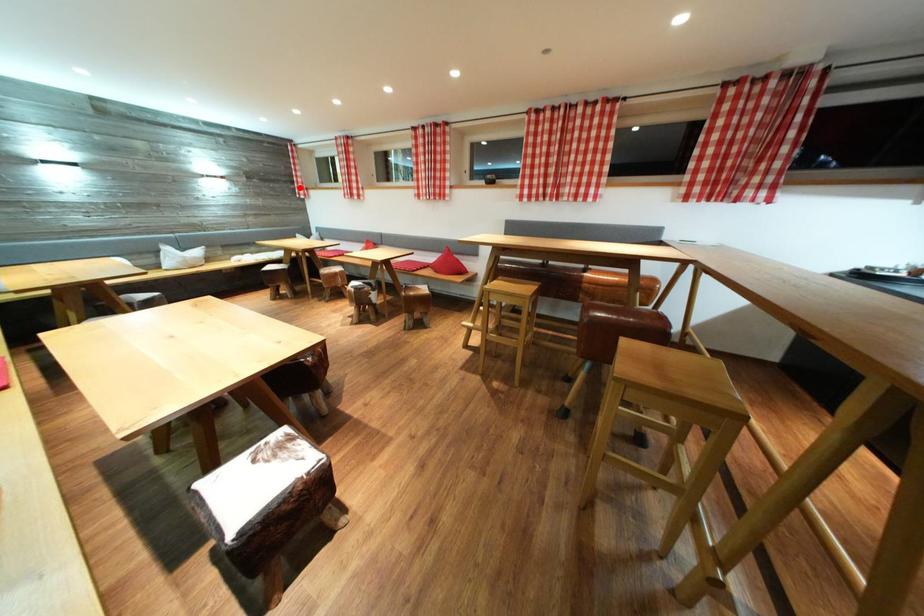
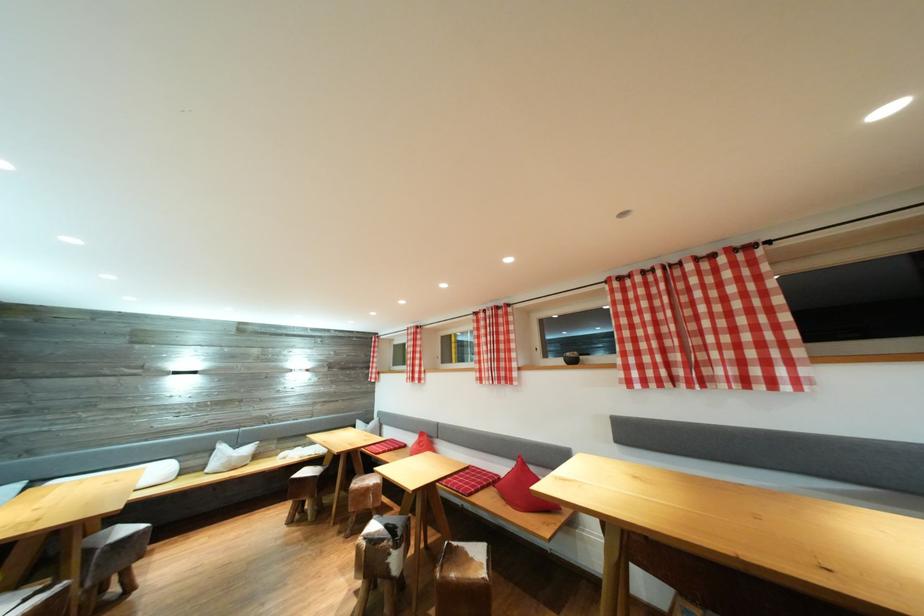
The point at the highlighted location is marked in the first image. Where is the corresponding point in the second image?

(375, 373)